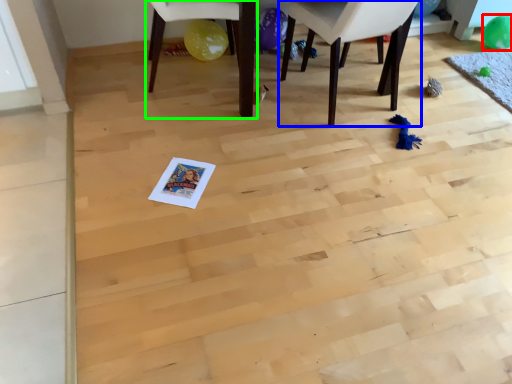
Question: Which object is the farthest from balloon (highlighted by a red box)? Choose among these: chair (highlighted by a blue box) or chair (highlighted by a green box).

Choices:
 (A) chair
 (B) chair

Answer: (B)